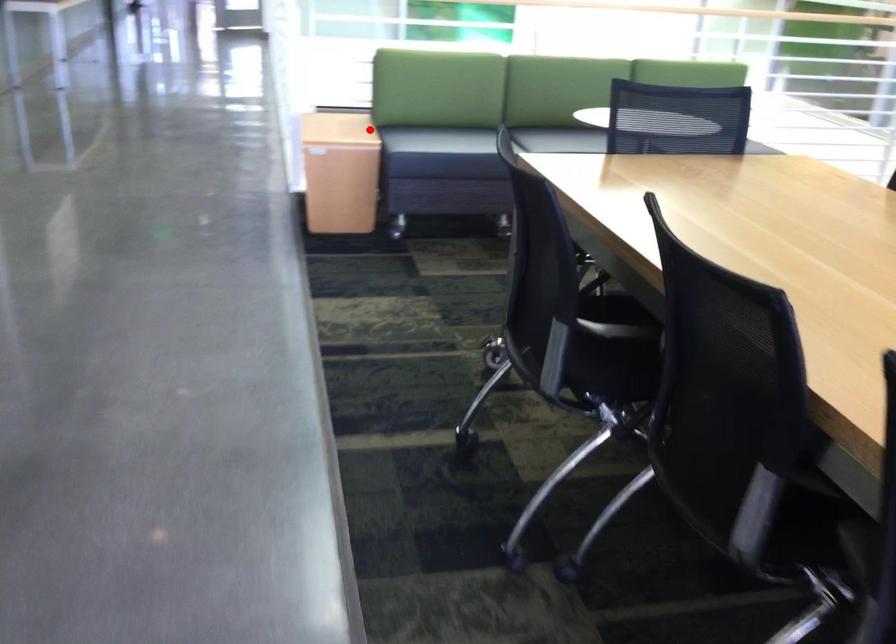
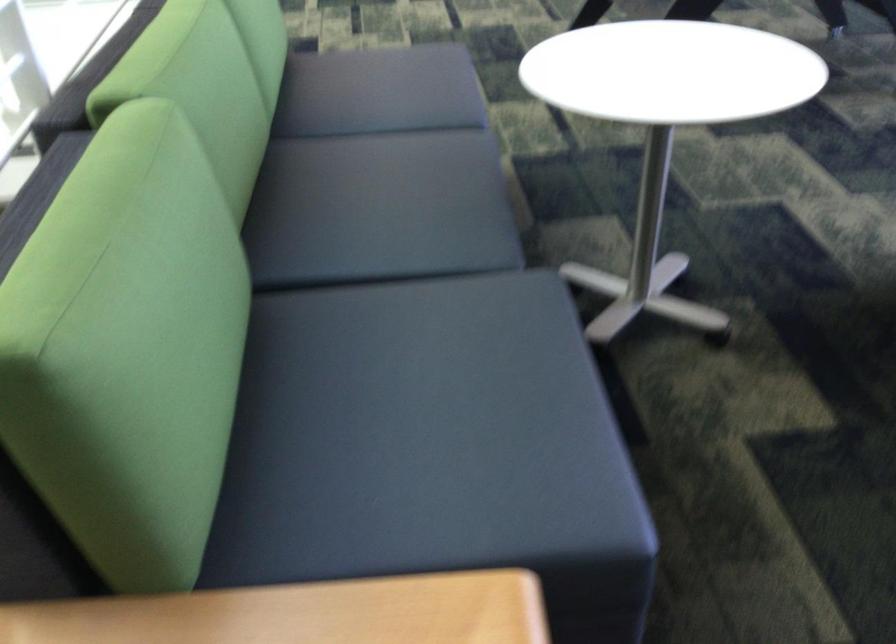
Question: I am providing you with two images of the same scene from different viewpoints. Given a red point in image1, look at the same physical point in image2. Is it:

Choices:
 (A) Closer to the viewpoint
 (B) Farther from the viewpoint

Answer: (A)